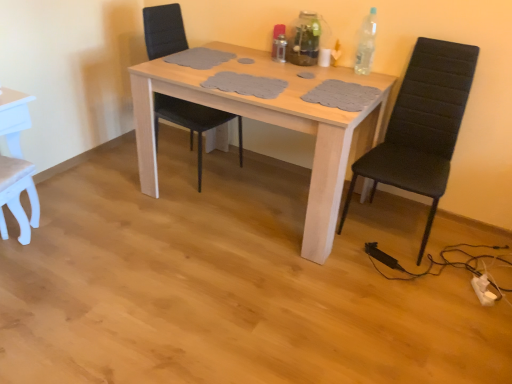
Locate an element on the screen. unoccupied region to the right of clear plastic bottle at upper right, the 1th bottle viewed from the right is located at coordinates (382, 76).